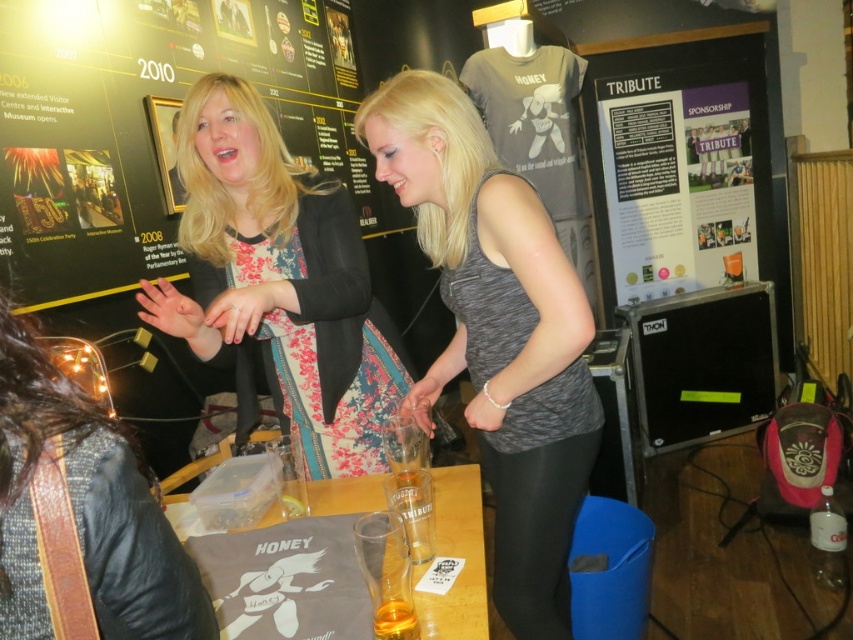
Question: Is white paper at upper center above clear glass mug at center?

Choices:
 (A) no
 (B) yes

Answer: (B)

Question: Which of the following is the closest to the observer?

Choices:
 (A) white paper at upper center
 (B) clear glass mug at center

Answer: (B)

Question: Is white paper at upper center bigger than translucent plastic cup at lower center?

Choices:
 (A) no
 (B) yes

Answer: (B)

Question: Which of the following is the closest to the observer?

Choices:
 (A) (291, 273)
 (B) (93, 150)
 (C) (465, 612)
 (D) (396, 609)

Answer: (D)

Question: Which of the following is the farthest from the observer?

Choices:
 (A) black matte poster at upper center
 (B) floral fabric dress at center

Answer: (A)

Question: Does gray matte tank top at center appear under translucent plastic cup at lower center?

Choices:
 (A) no
 (B) yes

Answer: (A)